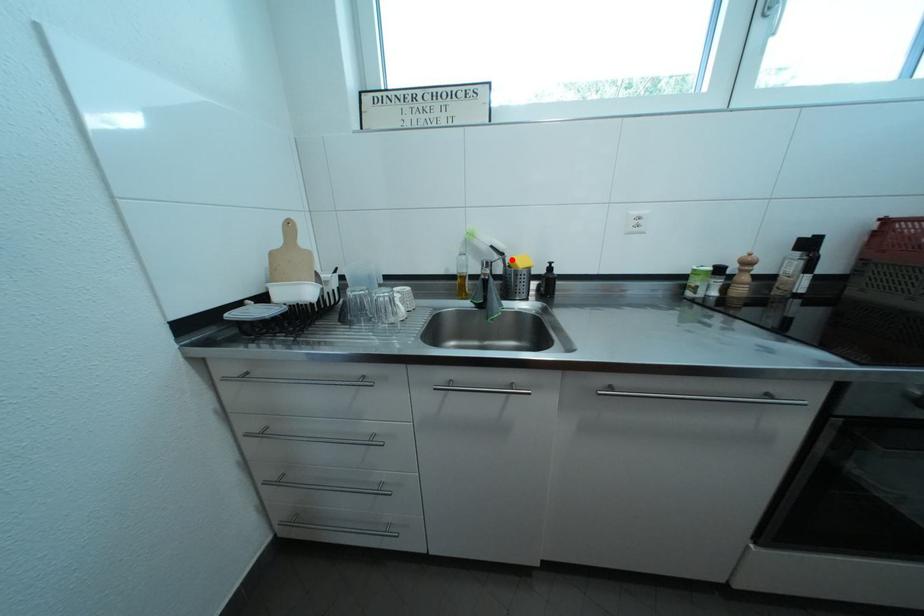
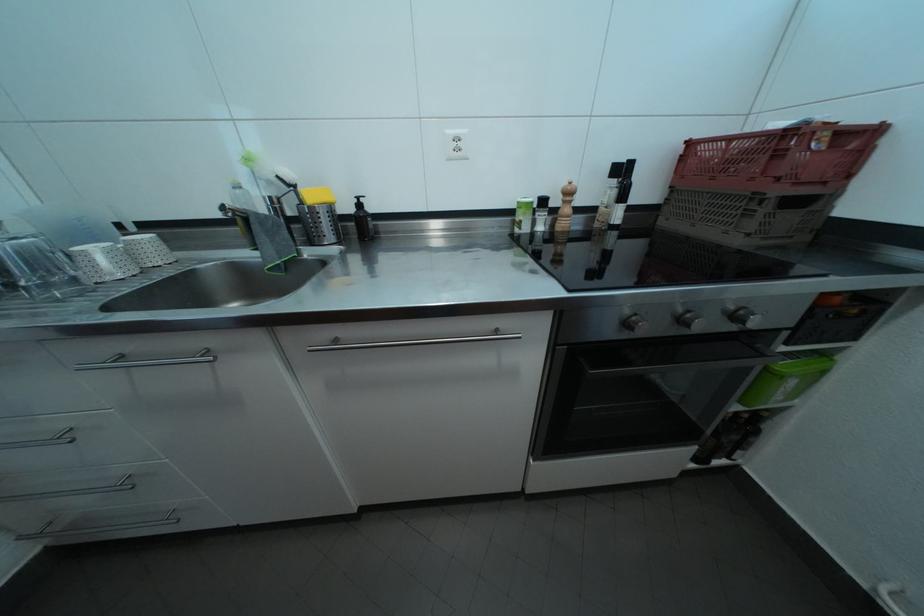
In the second image, find the point that corresponds to the highlighted location in the first image.

(304, 192)